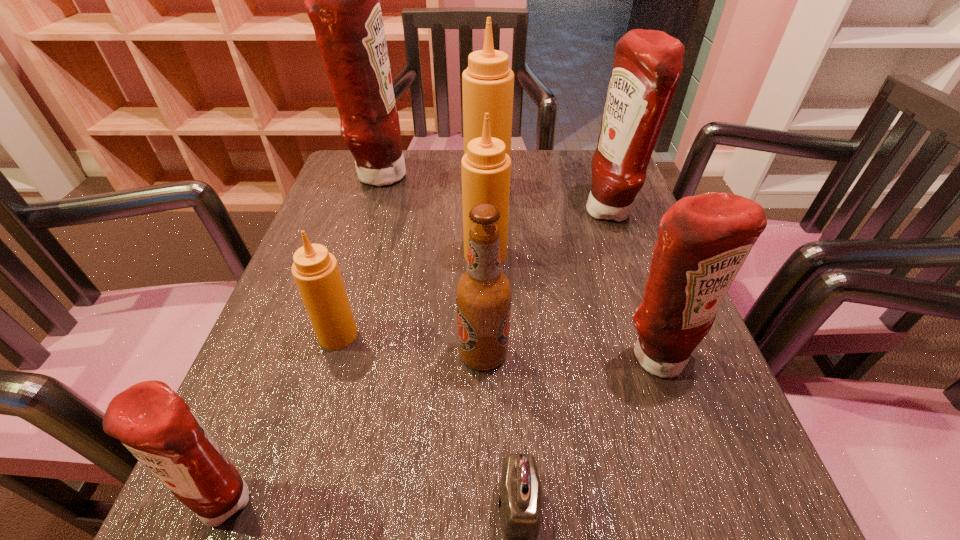
This screenshot has height=540, width=960. In order to click on free spot at the far left corner of the desktop in this screenshot , I will do `click(344, 200)`.

Find the location of a particular element. This screenshot has width=960, height=540. vacant region at the far right corner of the desktop is located at coordinates (588, 160).

Identify the location of free space at the near right corner of the desktop. (686, 535).

Where is `free space between the biggest tan condiment and the nearest condiment`? The height and width of the screenshot is (540, 960). free space between the biggest tan condiment and the nearest condiment is located at coordinates (359, 342).

Locate an element on the screen. The image size is (960, 540). vacant region between the beer bottle and the smallest tan condiment is located at coordinates (411, 345).

Find the location of a particular element. vacant area between the fourth farthest object and the second nearest red condiment is located at coordinates (571, 306).

Identify the location of free space between the beer bottle and the third smallest red condiment. This screenshot has height=540, width=960. (546, 283).

The image size is (960, 540). I want to click on free space between the biggest red condiment and the nearest red condiment, so click(x=304, y=336).

This screenshot has width=960, height=540. Find the location of `vacant area that lies between the farthest tan condiment and the smallest red condiment`. vacant area that lies between the farthest tan condiment and the smallest red condiment is located at coordinates (359, 342).

The image size is (960, 540). In order to click on vacant space that's between the second nearest red condiment and the third smallest red condiment in this screenshot , I will do `click(634, 285)`.